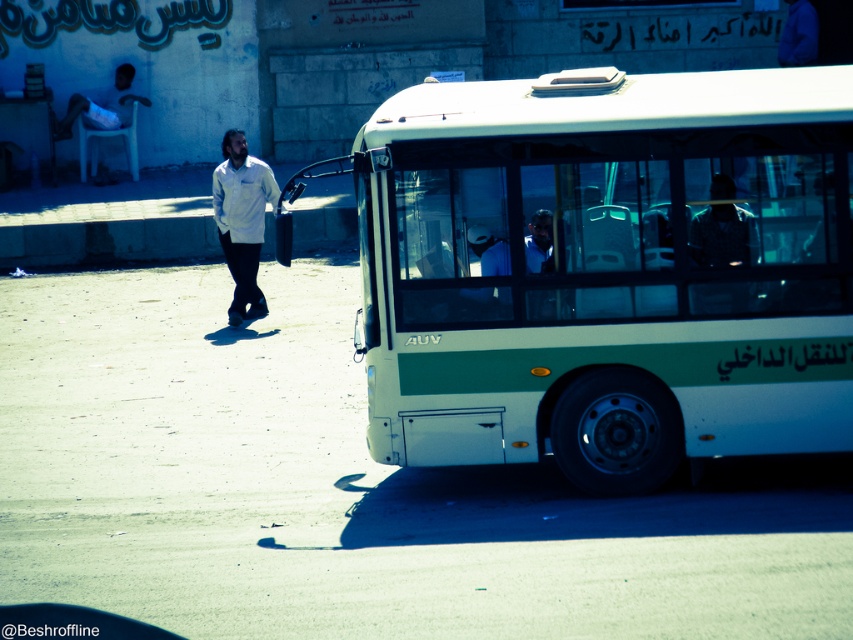
You are standing at the point with coordinates point (x=265, y=164) and want to walk to the point (x=682, y=417). Which direction should you move relative to the street scene?

To reach point (x=682, y=417) from point (x=265, y=164), you should move forward because point (x=682, y=417) is in front of point (x=265, y=164) in the street scene.

You are standing at the point marked by the coordinates (x=608, y=269) in the image. What object is located at this point?

The point at coordinates (x=608, y=269) corresponds to the white matte bus at center.

You are standing on the sidewalk and want to cross the street to reach a coffee shop located behind the white matte bus at center. The crosswalk is 10 meters away from your current position. Can you safely cross before the bus moves away?

The white matte bus at center is 9.96 meters away from the viewer. Since the crosswalk is 10 meters away, you can safely cross before the bus moves away as the distance to the crosswalk is slightly longer than the bus distance, giving you enough time.